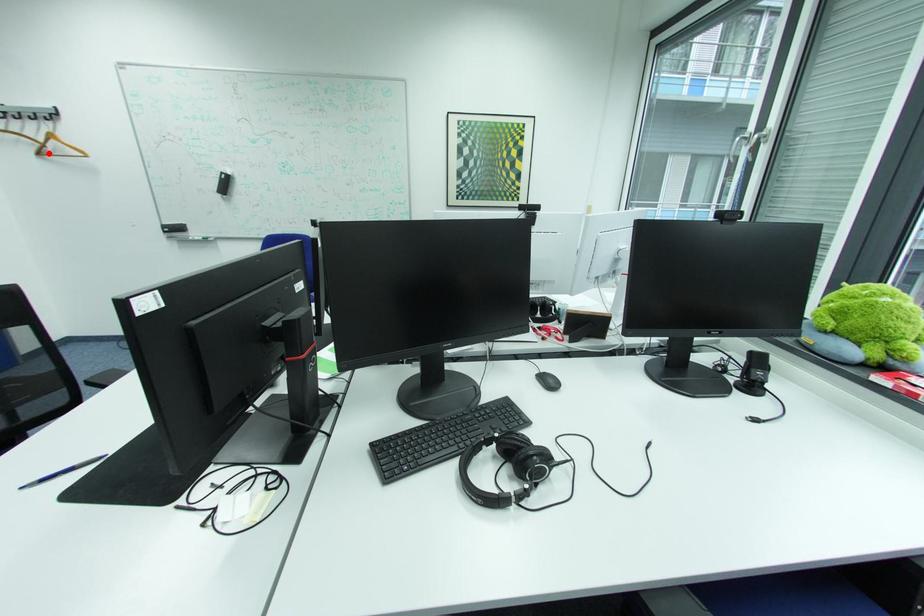
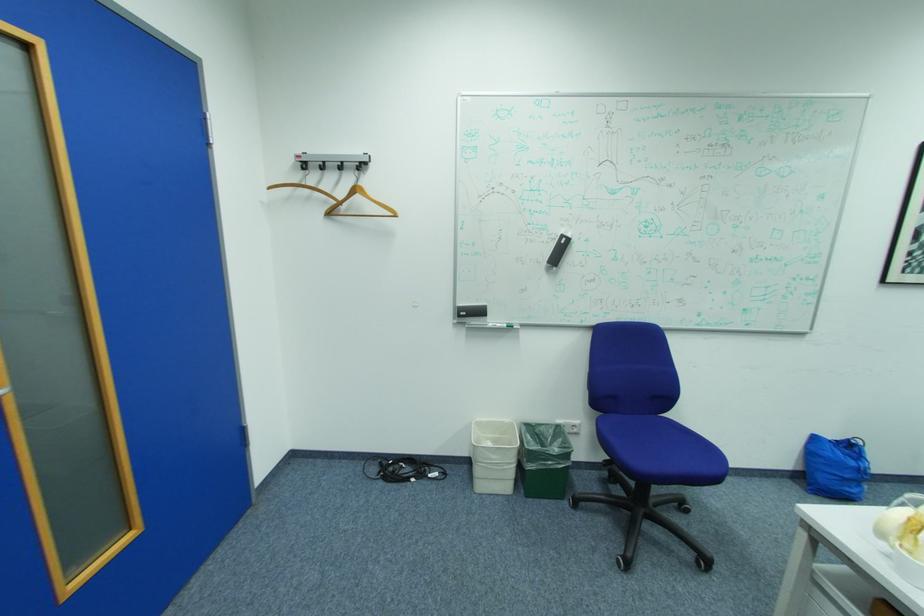
Where in the second image is the point corresponding to the highlighted location from the first image?

(337, 214)